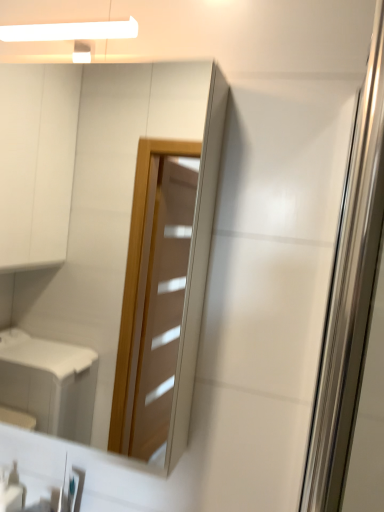
Question: Considering the positions of point (8, 487) and point (74, 80), is point (8, 487) closer or farther from the camera than point (74, 80)?

Choices:
 (A) farther
 (B) closer

Answer: (B)

Question: Considering the positions of white glossy soap dispenser at lower left and matte glass mirror at upper center in the image, is white glossy soap dispenser at lower left wider or thinner than matte glass mirror at upper center?

Choices:
 (A) thin
 (B) wide

Answer: (A)

Question: Which of these objects is positioned farthest from the white glossy soap dispenser at lower left?

Choices:
 (A) transparent glass screen door at right
 (B) matte glass mirror at upper center

Answer: (B)

Question: Which is nearer to the transparent glass screen door at right?

Choices:
 (A) white glossy soap dispenser at lower left
 (B) matte glass mirror at upper center

Answer: (A)